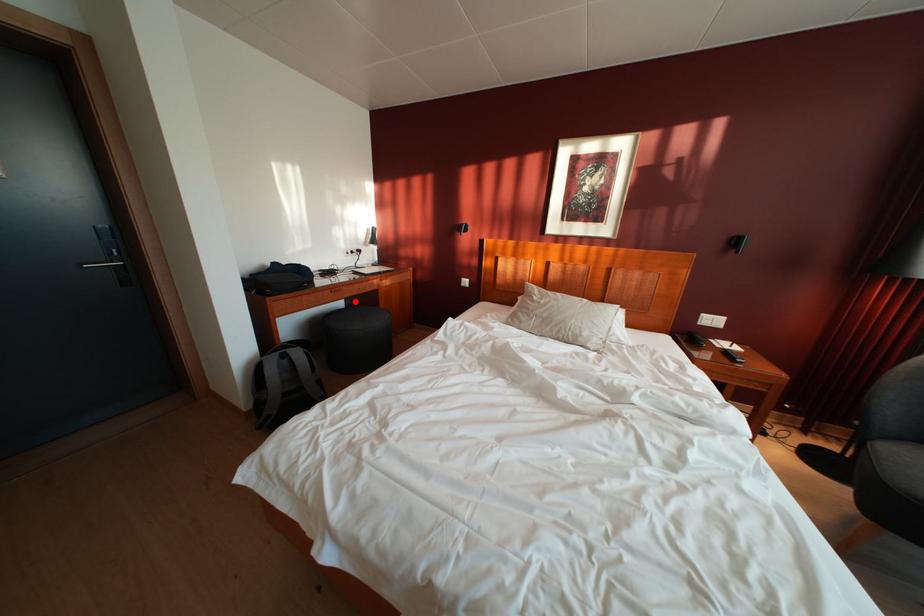
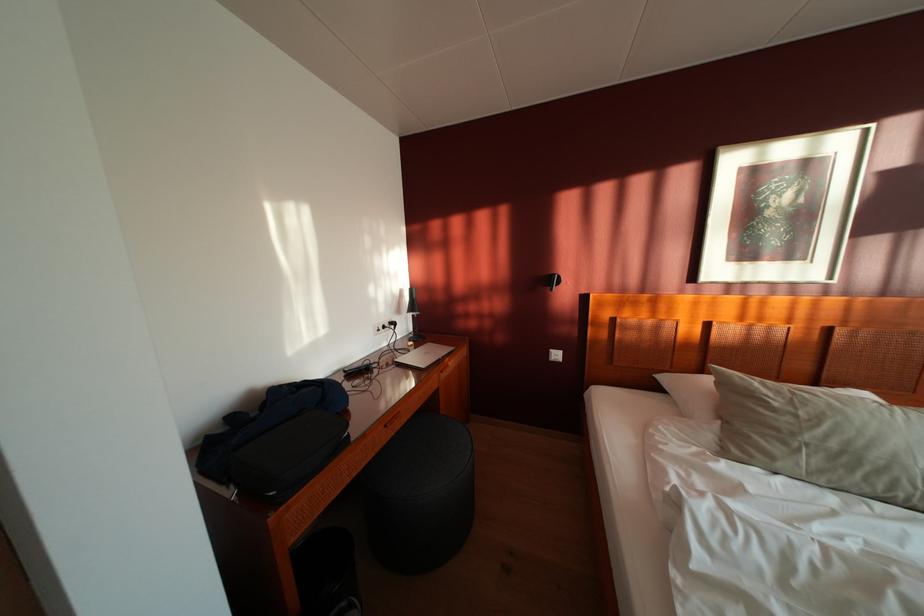
The point at the highlighted location is marked in the first image. Where is the corresponding point in the second image?

(412, 424)